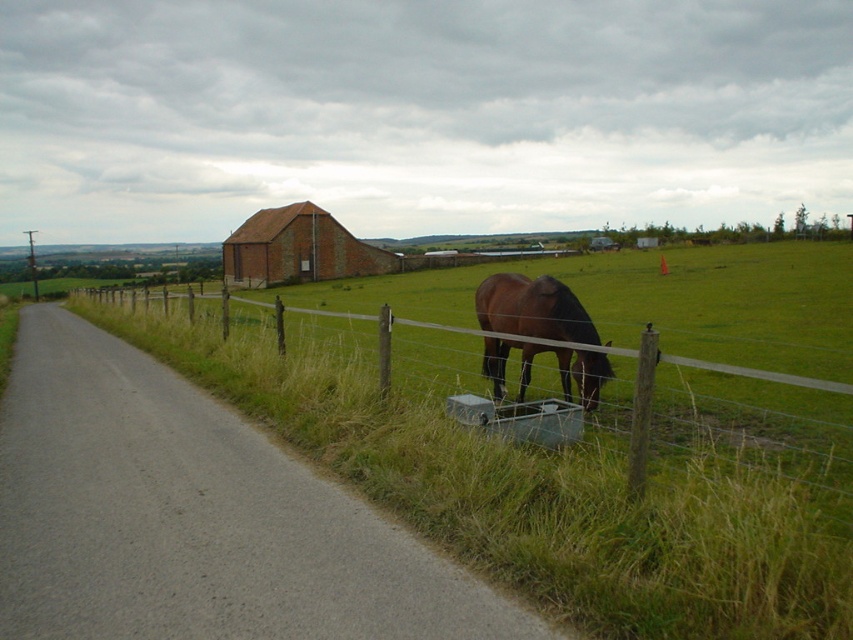
Looking at this image, you are a farmer standing at the edge of the wire mesh fence at lower right and want to reach the brick red barn at center. Which direction should you walk to get there?

The wire mesh fence at lower right is positioned under the brick red barn at center, so you should walk upwards towards the brick red barn at center to reach it.